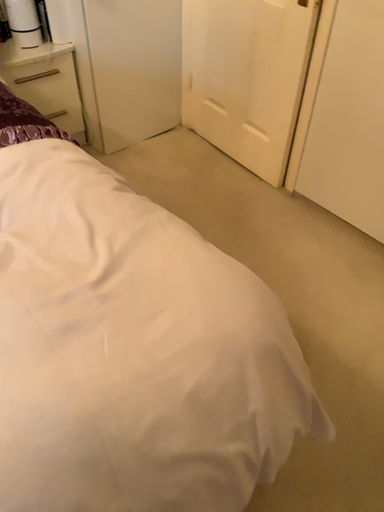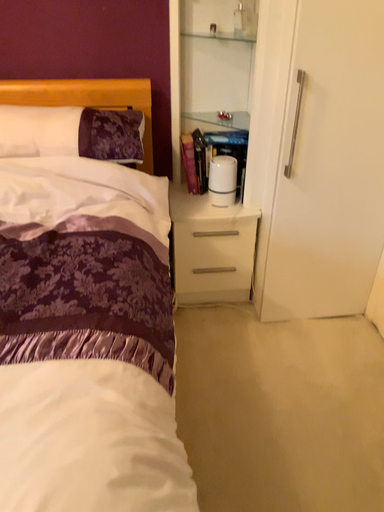
Question: How did the camera likely rotate when shooting the video?

Choices:
 (A) rotated upward
 (B) rotated downward

Answer: (A)